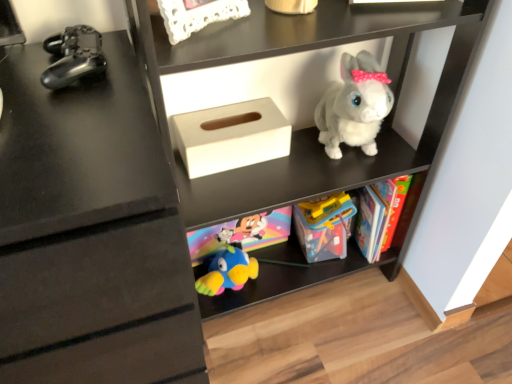
Question: Considering the relative sizes of fluffy white plush rabbit at upper right, which is the third toy in left-to-right order, and metallic black controller at left, which is counted as the third toy, starting from the back, in the image provided, is fluffy white plush rabbit at upper right, which is the third toy in left-to-right order, wider than metallic black controller at left, which is counted as the third toy, starting from the back,?

Choices:
 (A) no
 (B) yes

Answer: (B)

Question: From a real-world perspective, is fluffy white plush rabbit at upper right, marked as the second toy in a back-to-front arrangement, below metallic black controller at left, which appears as the 1th toy when viewed from the front?

Choices:
 (A) no
 (B) yes

Answer: (B)

Question: Is fluffy white plush rabbit at upper right, marked as the second toy in a back-to-front arrangement, beside metallic black controller at left, which appears as the 1th toy when viewed from the front?

Choices:
 (A) no
 (B) yes

Answer: (A)

Question: From the image's perspective, would you say fluffy white plush rabbit at upper right, which is the third toy in left-to-right order, is shown under metallic black controller at left, marked as the first toy in a left-to-right arrangement?

Choices:
 (A) yes
 (B) no

Answer: (A)

Question: Could you tell me if fluffy white plush rabbit at upper right, the 1th toy in the right-to-left sequence, is facing metallic black controller at left, which is the third toy from right to left?

Choices:
 (A) no
 (B) yes

Answer: (A)

Question: Is fluffy white plush rabbit at upper right, marked as the second toy in a back-to-front arrangement, at the left side of metallic black controller at left, which is counted as the third toy, starting from the back?

Choices:
 (A) yes
 (B) no

Answer: (B)

Question: From the image's perspective, does white matte plush rabbit at upper center appear higher than translucent plastic toy at center, which is the 2th toy in right-to-left order?

Choices:
 (A) yes
 (B) no

Answer: (A)

Question: From a real-world perspective, is white matte plush rabbit at upper center located higher than translucent plastic toy at center, which is the 2th toy in right-to-left order?

Choices:
 (A) no
 (B) yes

Answer: (B)

Question: Is the surface of white matte plush rabbit at upper center in direct contact with translucent plastic toy at center, the 2th toy positioned from the left?

Choices:
 (A) yes
 (B) no

Answer: (B)

Question: Does white matte plush rabbit at upper center come in front of translucent plastic toy at center, placed as the third toy when sorted from front to back?

Choices:
 (A) yes
 (B) no

Answer: (A)

Question: Considering the relative positions of white matte plush rabbit at upper center and translucent plastic toy at center, placed as the third toy when sorted from front to back, in the image provided, is white matte plush rabbit at upper center to the left of translucent plastic toy at center, placed as the third toy when sorted from front to back, from the viewer's perspective?

Choices:
 (A) yes
 (B) no

Answer: (A)

Question: Is white matte plush rabbit at upper center further to the viewer compared to translucent plastic toy at center, acting as the first toy starting from the back?

Choices:
 (A) yes
 (B) no

Answer: (B)

Question: From a real-world perspective, is white matte plush rabbit at upper center below white matte tissue box at center?

Choices:
 (A) no
 (B) yes

Answer: (B)